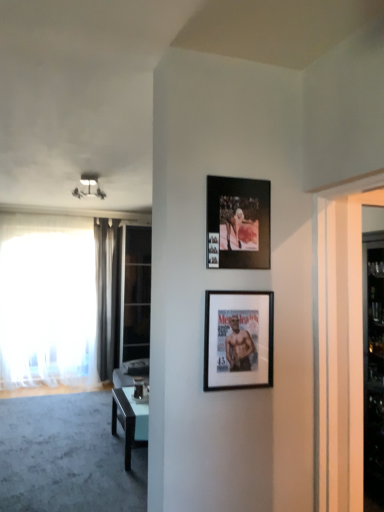
The image size is (384, 512). What are the coordinates of `blank space situated above matte white light fixture at upper left (from a real-world perspective)` in the screenshot? It's located at (89, 178).